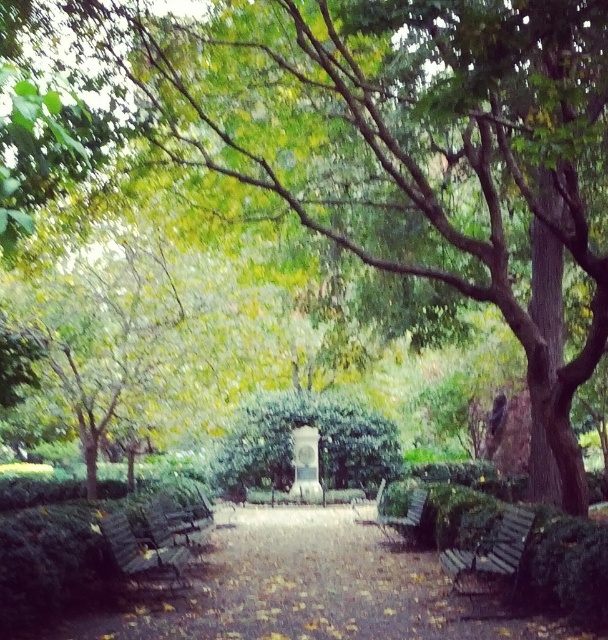
You are standing at the camera position in the park scene. There are two points marked in the image, one at coordinates point [83,554] and another at point [359,451]. Which point is nearer to your current position?

Point [83,554] is closer to the camera than point [359,451], so the point at coordinates point [83,554] is nearer to your current position.

You are walking along the park pathway and want to sit on the nearest bench. You see the green leafy hedge at lower left and the green leafy hedge at center. Which hedge is closer to your current position?

The green leafy hedge at lower left is closer to your current position because it is positioned over the green leafy hedge at center, indicating it is in front.

In the scene shown: You are a maintenance worker who needs to place a 3.5 meter long hose between the wooden park bench at lower left and the wooden park bench at center. Based on the scene description, will the hose fit between them?

The distance between the wooden park bench at lower left and the wooden park bench at center is 3.23 meters. Since the hose is 3.5 meters long, it is longer than the available space, so the hose will not fit between them.